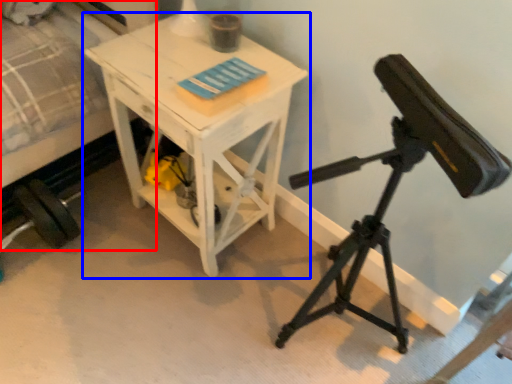
Question: Which object is closer to the camera taking this photo, bed (highlighted by a red box) or table (highlighted by a blue box)?

Choices:
 (A) bed
 (B) table

Answer: (A)